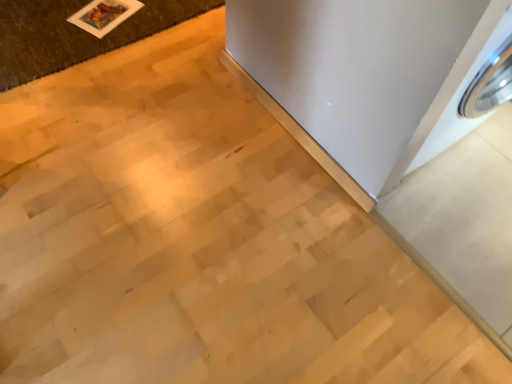
At what (x,y) coordinates should I click in order to perform the action: click on free space above white matte picture frame at upper left (from a real-world perspective). Please return your answer as a coordinate pair (x, y). The width and height of the screenshot is (512, 384). Looking at the image, I should click on (104, 13).